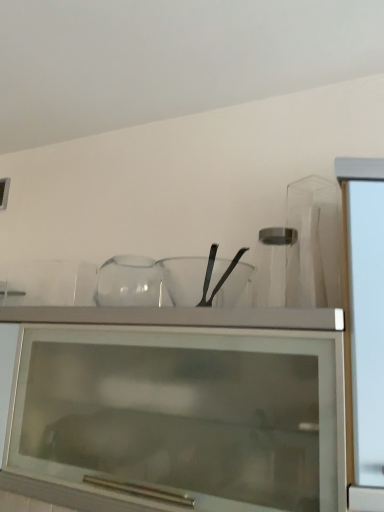
Question: In the image, is transparent glass jar at center positioned in front of or behind transparent glass cabinet at upper center?

Choices:
 (A) front
 (B) behind

Answer: (B)

Question: Do you think transparent glass jar at center is within transparent glass cabinet at upper center, or outside of it?

Choices:
 (A) inside
 (B) outside

Answer: (B)

Question: Which is farther from the transparent glass mixing bowl at center?

Choices:
 (A) transparent glass cabinet at upper center
 (B) transparent glass jar at center

Answer: (A)

Question: Estimate the real-world distances between objects in this image. Which object is farther from the transparent glass mixing bowl at center?

Choices:
 (A) transparent glass jar at center
 (B) transparent glass cabinet at upper center

Answer: (B)